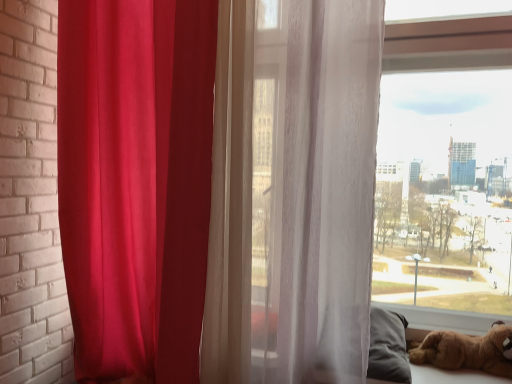
Question: Is matte red curtain at left, which is the second curtain from right to left, bigger or smaller than brown plush toy at lower right?

Choices:
 (A) big
 (B) small

Answer: (A)

Question: From a real-world perspective, is matte red curtain at left, the first curtain viewed from the left, physically located above or below brown plush toy at lower right?

Choices:
 (A) below
 (B) above

Answer: (B)

Question: Estimate the real-world distances between objects in this image. Which object is farther from the translucent white curtain at center, the 1th curtain from the right?

Choices:
 (A) brown plush toy at lower right
 (B) matte red curtain at left, which is the second curtain from right to left

Answer: (A)

Question: Which object is positioned farthest from the translucent white curtain at center, which is counted as the second curtain, starting from the left?

Choices:
 (A) brown plush toy at lower right
 (B) matte red curtain at left, the first curtain viewed from the left

Answer: (A)